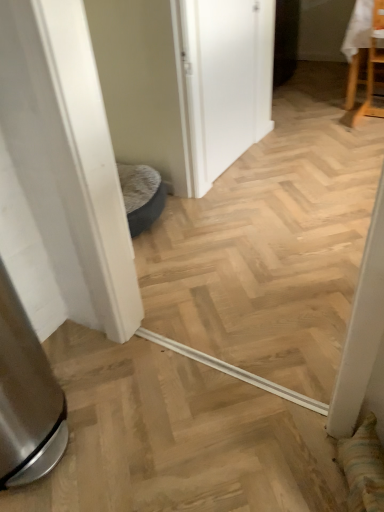
What do you see at coordinates (372, 67) in the screenshot? The width and height of the screenshot is (384, 512). I see `wooden chair at upper right` at bounding box center [372, 67].

You are a GUI agent. You are given a task and a screenshot of the screen. Output one action in this format:
    pyautogui.click(x=<x>, y=<y>)
    Task: Click on the wooden chair at upper right
    Image resolution: width=384 pixels, height=512 pixels.
    Given the screenshot: What is the action you would take?
    pyautogui.click(x=372, y=67)

You are a GUI agent. You are given a task and a screenshot of the screen. Output one action in this format:
    pyautogui.click(x=<x>, y=<y>)
    Task: Click on the white matte door at center
    
    Given the screenshot: What is the action you would take?
    pyautogui.click(x=222, y=81)

What do you see at coordinates (222, 81) in the screenshot?
I see `white matte door at center` at bounding box center [222, 81].

You are a GUI agent. You are given a task and a screenshot of the screen. Output one action in this format:
    pyautogui.click(x=<x>, y=<y>)
    Task: Click on the wooden chair at upper right
    Image resolution: width=384 pixels, height=512 pixels.
    Given the screenshot: What is the action you would take?
    pyautogui.click(x=372, y=67)

In the image, is wooden chair at upper right on the left side or the right side of white matte door at center?

Based on their positions, wooden chair at upper right is located to the right of white matte door at center.

Considering the positions of objects wooden chair at upper right and white matte door at center in the image provided, who is behind, wooden chair at upper right or white matte door at center?

wooden chair at upper right is more distant.

Considering the positions of point (374, 16) and point (267, 68), is point (374, 16) closer or farther from the camera than point (267, 68)?

Point (374, 16) is farther from the camera than point (267, 68).

From the image's perspective, is wooden chair at upper right beneath white matte door at center?

No, from the image's perspective, wooden chair at upper right is not beneath white matte door at center.

From a real-world perspective, who is located lower, wooden chair at upper right or white matte door at center?

wooden chair at upper right, from a real-world perspective.

Is wooden chair at upper right thinner than white matte door at center?

Incorrect, the width of wooden chair at upper right is not less than that of white matte door at center.

Who is taller, wooden chair at upper right or white matte door at center?

With more height is white matte door at center.

Who is smaller, wooden chair at upper right or white matte door at center?

With smaller size is white matte door at center.

Would you say white matte door at center is part of wooden chair at upper right's contents?

No, white matte door at center is located outside of wooden chair at upper right.

Are wooden chair at upper right and white matte door at center far apart?

Yes, wooden chair at upper right and white matte door at center are quite far apart.

Is wooden chair at upper right turned away from white matte door at center?

No, white matte door at center is not at the back of wooden chair at upper right.

The height and width of the screenshot is (512, 384). In the image, there is a white matte door at center. In order to click on chair below it (from a real-world perspective) in this screenshot , I will do (x=372, y=67).

Considering the positions of objects white matte door at center and wooden chair at upper right in the image provided, who is more to the right, white matte door at center or wooden chair at upper right?

From the viewer's perspective, wooden chair at upper right appears more on the right side.

Is white matte door at center further to camera compared to wooden chair at upper right?

No, the depth of white matte door at center is less than that of wooden chair at upper right.

Is point (262, 117) more distant than point (381, 52)?

No.

Consider the image. From the image's perspective, is white matte door at center above wooden chair at upper right?

No, from the image's perspective, white matte door at center is not over wooden chair at upper right.

From a real-world perspective, does white matte door at center stand above wooden chair at upper right?

Indeed, from a real-world perspective, white matte door at center stands above wooden chair at upper right.

From the picture: Which of these two, white matte door at center or wooden chair at upper right, is wider?

With larger width is wooden chair at upper right.

Considering the sizes of objects white matte door at center and wooden chair at upper right in the image provided, who is taller, white matte door at center or wooden chair at upper right?

With more height is white matte door at center.

Between white matte door at center and wooden chair at upper right, which one has larger size?

Bigger between the two is wooden chair at upper right.

Is wooden chair at upper right surrounded by white matte door at center?

No, white matte door at center does not contain wooden chair at upper right.

Is white matte door at center positioned far away from wooden chair at upper right?

Yes, white matte door at center and wooden chair at upper right are quite far apart.

Is white matte door at center facing away from wooden chair at upper right?

No, white matte door at center is not facing the opposite direction of wooden chair at upper right.

How many degrees apart are the facing directions of white matte door at center and wooden chair at upper right?

The angle between the facing direction of white matte door at center and the facing direction of wooden chair at upper right is 89.3 degrees.

The height and width of the screenshot is (512, 384). What are the coordinates of `chair below the white matte door at center (from a real-world perspective)` in the screenshot? It's located at (372, 67).

Find the location of `chair lying on the right of white matte door at center`. chair lying on the right of white matte door at center is located at coordinates (372, 67).

In the image, there is a wooden chair at upper right. In order to click on screen door below it (from the image's perspective) in this screenshot , I will do `click(222, 81)`.